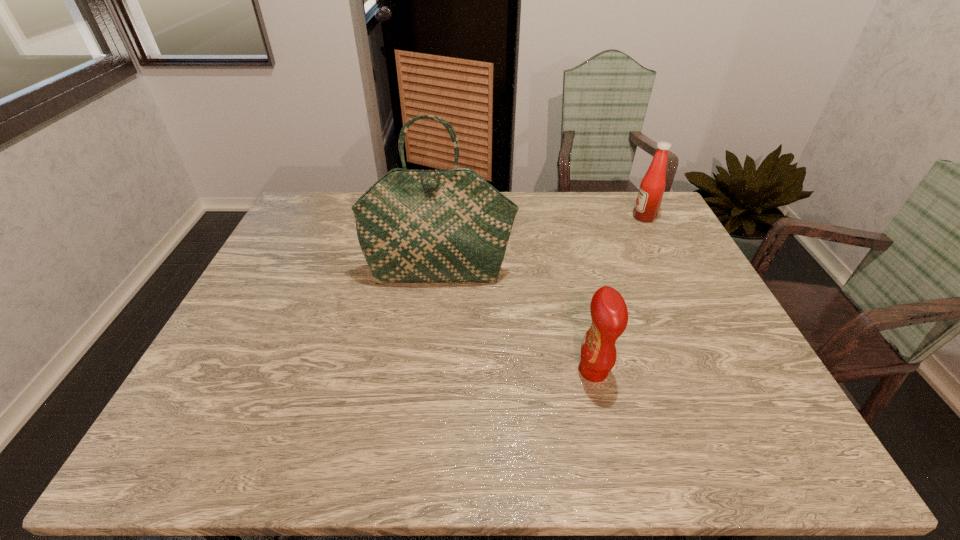
You are a GUI agent. You are given a task and a screenshot of the screen. Output one action in this format:
    pyautogui.click(x=<x>, y=<y>)
    Task: Click on the tote bag
    
    Given the screenshot: What is the action you would take?
    pyautogui.click(x=448, y=225)

Locate an element on the screen. The height and width of the screenshot is (540, 960). the leftmost object is located at coordinates (448, 225).

Where is `the farthest object`? This screenshot has height=540, width=960. the farthest object is located at coordinates (648, 201).

Identify the location of the rightmost object. The image size is (960, 540). (648, 201).

This screenshot has width=960, height=540. Find the location of `the nearer condiment`. the nearer condiment is located at coordinates coord(609,313).

The width and height of the screenshot is (960, 540). What are the coordinates of `the left condiment` in the screenshot? It's located at (609, 313).

Locate an element on the screen. This screenshot has width=960, height=540. vacant space located on the right of the second nearest object is located at coordinates (580, 273).

The width and height of the screenshot is (960, 540). Find the location of `blank space located 0.140m on the front-facing side of the right condiment`. blank space located 0.140m on the front-facing side of the right condiment is located at coordinates (592, 217).

Where is `vacant space situated on the front-facing side of the right condiment`? The image size is (960, 540). vacant space situated on the front-facing side of the right condiment is located at coordinates (589, 217).

Where is `free space located 0.200m on the front-facing side of the right condiment`? The width and height of the screenshot is (960, 540). free space located 0.200m on the front-facing side of the right condiment is located at coordinates pos(575,217).